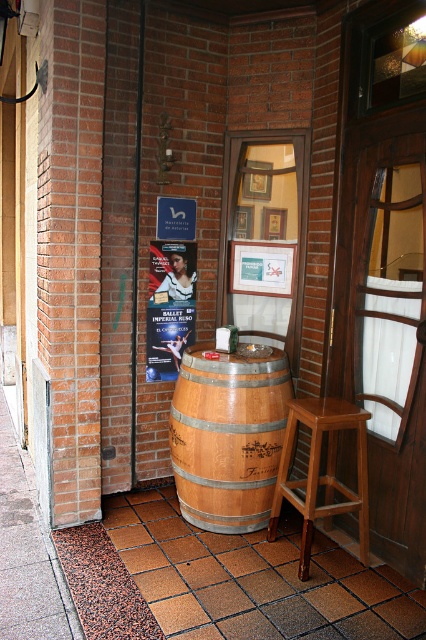
Question: Which point is closer to the camera?

Choices:
 (A) (284, 458)
 (B) (189, 248)
 (C) (256, 400)
 (D) (279, 627)

Answer: (D)

Question: Is light brown wooden bar stool at center positioned at the back of matte paper poster at center?

Choices:
 (A) no
 (B) yes

Answer: (A)

Question: Considering the relative positions of brown tile pavement at lower center and light brown wooden bar stool at center in the image provided, where is brown tile pavement at lower center located with respect to light brown wooden bar stool at center?

Choices:
 (A) right
 (B) left

Answer: (B)

Question: Does brown tile pavement at lower center have a smaller size compared to light brown wooden bar stool at center?

Choices:
 (A) no
 (B) yes

Answer: (A)

Question: Which point is closer to the camera?

Choices:
 (A) pos(163,275)
 (B) pos(196,524)

Answer: (B)

Question: Among these objects, which one is farthest from the camera?

Choices:
 (A) brown tile pavement at lower center
 (B) wooden barrel at center
 (C) light brown wooden bar stool at center

Answer: (B)